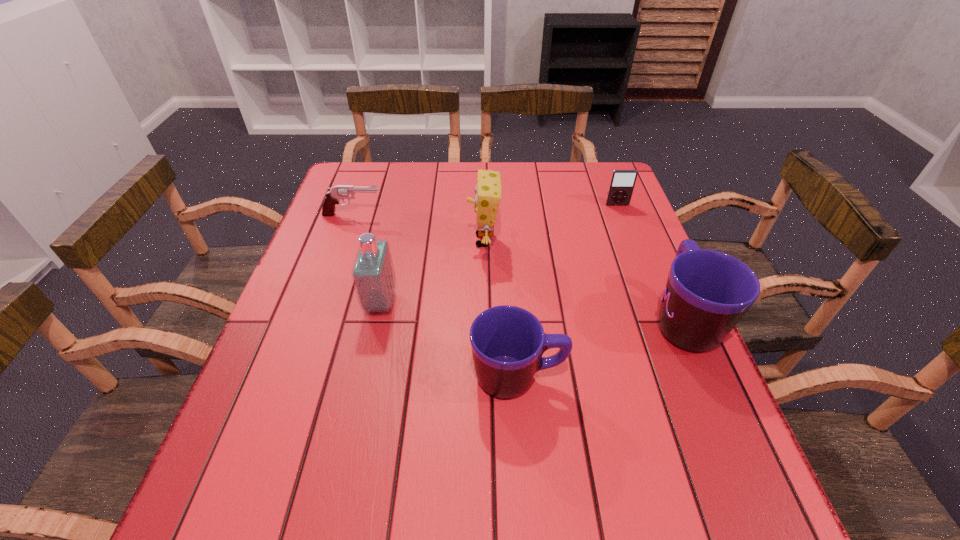
The mugs are evenly distributed in the image. To maintain this, where would you place another mug on the left? Please point to a free space. Please provide its 2D coordinates. Your answer should be formatted as a tuple, i.e. [(x, y)], where the tuple contains the x and y coordinates of a point satisfying the conditions above.

[(306, 451)]